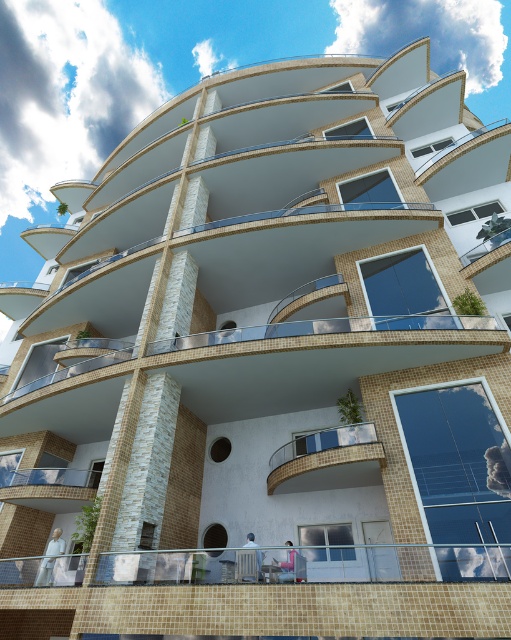
You are an architect evaluating the structural integrity of the building. You notice two key features, the white glossy balcony at center and the glassy transparent balcony at lower left. Which of these two balconies has a narrower width?

The white glossy balcony at center is thinner than the glassy transparent balcony at lower left, so the white glossy balcony at center has a narrower width.

You are standing at point A, which is at coordinates point A at (303, 468). You want to walk to point B, which is 9.80 meters away from point A. Can you estimate how far you need to walk to reach point B from point A?

You need to walk 9.80 meters to reach point B from point A.

You are a delivery drone with a wingspan of 2 meters. You need to fly between the white glossy balcony at center and the glassy transparent balcony at lower left. Can you safely pass through the space between them without touching either balcony?

The white glossy balcony at center and glassy transparent balcony at lower left are 5.99 meters apart from each other. Since your drone has a wingspan of 2 meters, there is sufficient space between them for safe passage without touching either balcony.